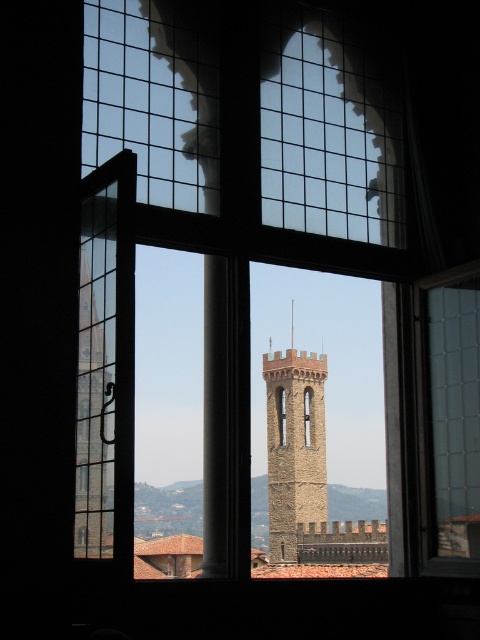
Question: Which point is closer to the camera?

Choices:
 (A) stone tower at left
 (B) brown stone bell tower at center

Answer: (A)

Question: Can you confirm if stone tower at left is bigger than brown stone bell tower at center?

Choices:
 (A) yes
 (B) no

Answer: (B)

Question: From the image, what is the correct spatial relationship of stone tower at left in relation to brown stone bell tower at center?

Choices:
 (A) below
 (B) above

Answer: (B)

Question: Does stone tower at left appear on the right side of brown stone bell tower at center?

Choices:
 (A) no
 (B) yes

Answer: (A)

Question: Which of the following is the farthest from the observer?

Choices:
 (A) brown stone bell tower at center
 (B) stone tower at left

Answer: (A)